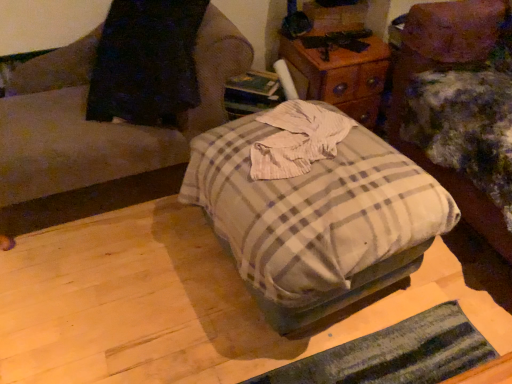
The width and height of the screenshot is (512, 384). Find the location of `free space below plaid fabric ottoman at center, the second furniture when ordered from right to left (from a real-world perspective)`. free space below plaid fabric ottoman at center, the second furniture when ordered from right to left (from a real-world perspective) is located at coordinates (104, 203).